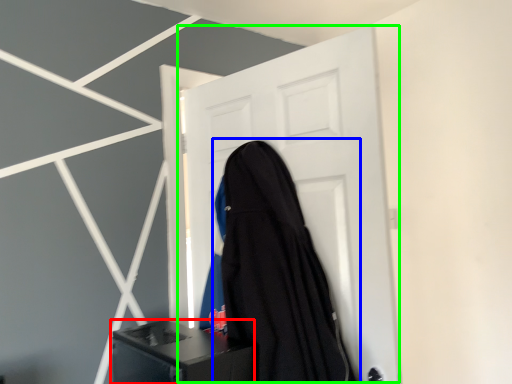
Question: Which is farther away from furniture (highlighted by a red box)? garment (highlighted by a blue box) or door (highlighted by a green box)?

Choices:
 (A) garment
 (B) door

Answer: (B)